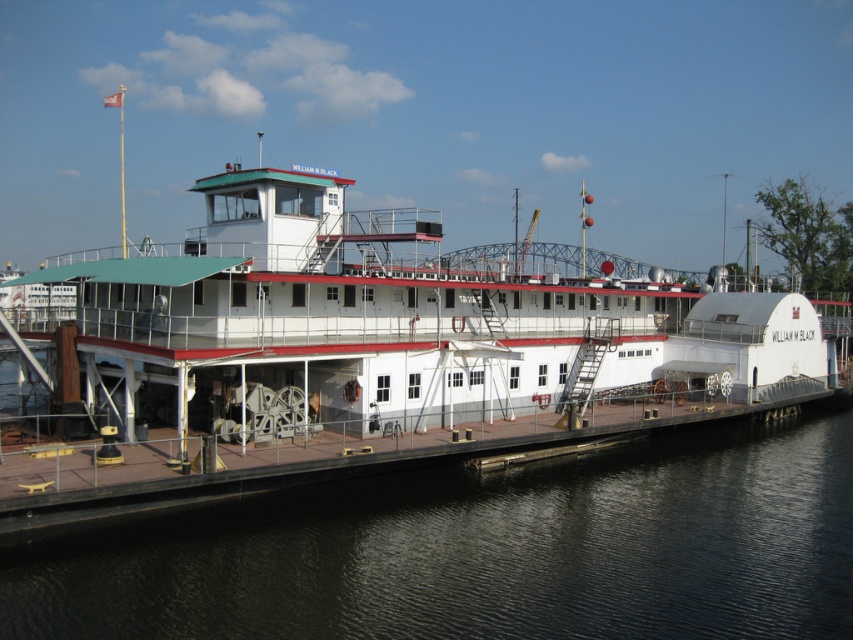
You are standing on the pier next to the white matte boat at center and want to take a photo of it from a distance. If your camera can focus up to 20 meters, will you be able to capture the boat clearly?

The distance between you and the white matte boat at center is 21.36 meters, which exceeds the camera focus limit of 20 meters. Therefore, you won not be able to capture the boat clearly.

You are standing on the wooden pier next to the white matte boat at center. If you look towards the direction where the black water at lower left is located, which direction would that be relative to the boat?

The black water at lower left is behind the white matte boat at center, so looking towards the black water at lower left from the pier would mean facing away from the boat, indicating that direction is behind the boat.